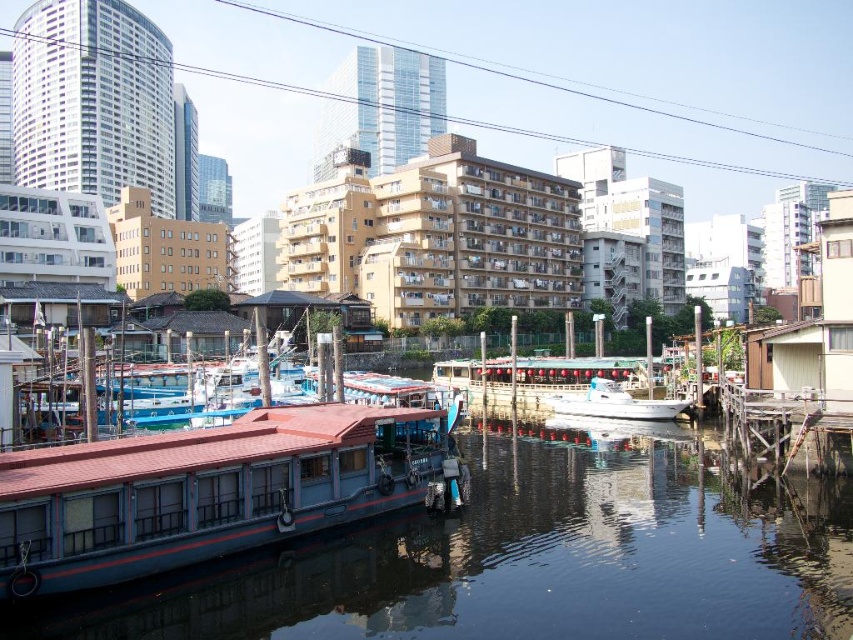
Is blue wooden boat at lower left bigger than blue painted wood boat at lower left?

Indeed, blue wooden boat at lower left has a larger size compared to blue painted wood boat at lower left.

Which is more to the right, blue wooden boat at lower left or blue painted wood boat at lower left?

From the viewer's perspective, blue wooden boat at lower left appears more on the right side.

Identify the location of blue wooden boat at lower left. This screenshot has height=640, width=853. (521, 560).

Who is shorter, blue wooden boat at lower left or white glossy boat at center?

With less height is white glossy boat at center.

Who is more forward, (637, 593) or (614, 384)?

Point (637, 593)

Locate an element on the screen. The height and width of the screenshot is (640, 853). blue wooden boat at lower left is located at coordinates (521, 560).

In the scene shown: Who is more forward, (440, 497) or (581, 392)?

Point (440, 497) is in front.

Find the location of a particular element. This screenshot has width=853, height=640. blue painted wood boat at lower left is located at coordinates (212, 490).